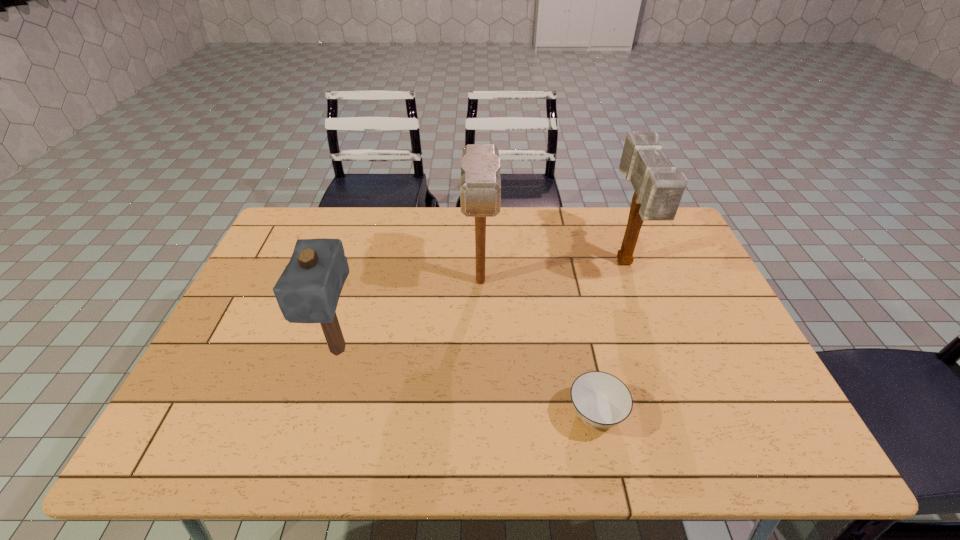
Find the location of a particular element. The width and height of the screenshot is (960, 540). the second mallet from right to left is located at coordinates (480, 186).

Locate an element on the screen. the rightmost mallet is located at coordinates (658, 189).

At what (x,y) coordinates should I click in order to perform the action: click on the third tallest object. Please return your answer as a coordinate pair (x, y). Looking at the image, I should click on (308, 290).

You are a GUI agent. You are given a task and a screenshot of the screen. Output one action in this format:
    pyautogui.click(x=<x>, y=<y>)
    Task: Click on the leftmost object
    Image resolution: width=960 pixels, height=540 pixels.
    Given the screenshot: What is the action you would take?
    pyautogui.click(x=308, y=290)

The width and height of the screenshot is (960, 540). Find the location of `soup bowl`. soup bowl is located at coordinates (601, 400).

The image size is (960, 540). Find the location of `the shortest object`. the shortest object is located at coordinates (601, 400).

Where is `free space located on the striking face of the third object from right to left`? The height and width of the screenshot is (540, 960). free space located on the striking face of the third object from right to left is located at coordinates (480, 321).

At what (x,y) coordinates should I click in order to perform the action: click on vacant area located 0.180m on the left of the rightmost mallet. Please return your answer as a coordinate pair (x, y). The image size is (960, 540). Looking at the image, I should click on (554, 264).

The width and height of the screenshot is (960, 540). In order to click on vacant space located 0.170m on the right of the second shortest object in this screenshot , I will do `click(424, 350)`.

Identify the location of free space located on the back of the shortest object. This screenshot has height=540, width=960. (571, 296).